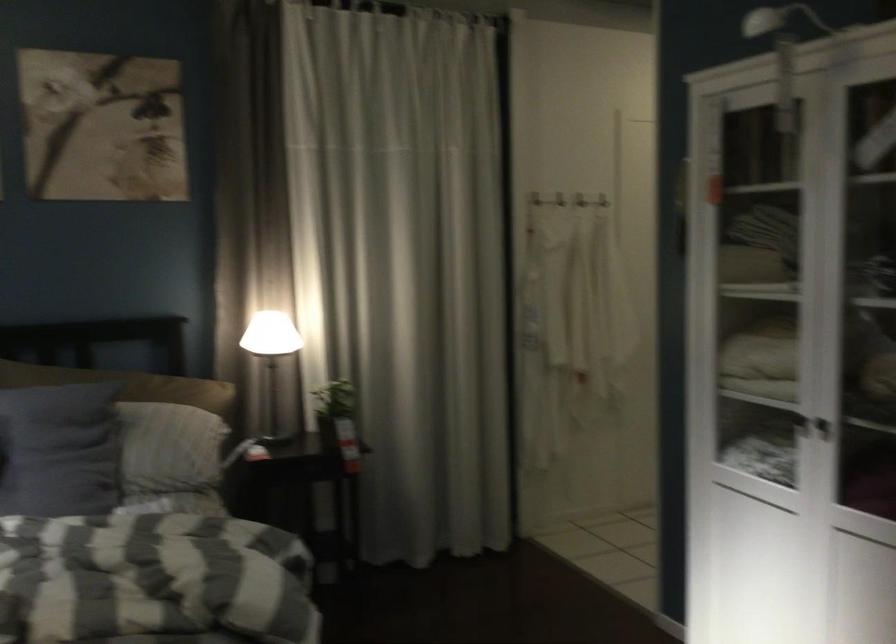
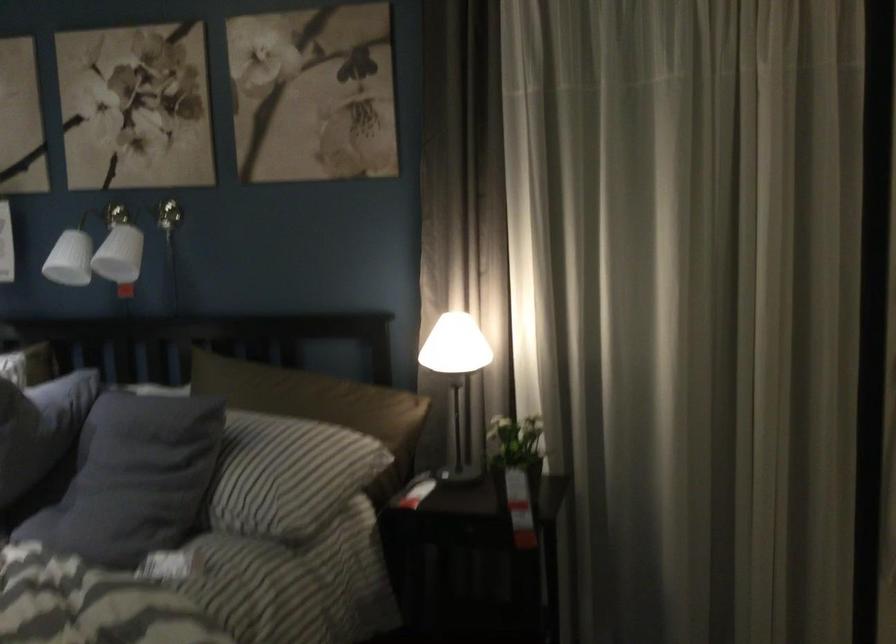
Locate, in the second image, the point that corresponds to pixel 281 357 in the first image.

(455, 375)